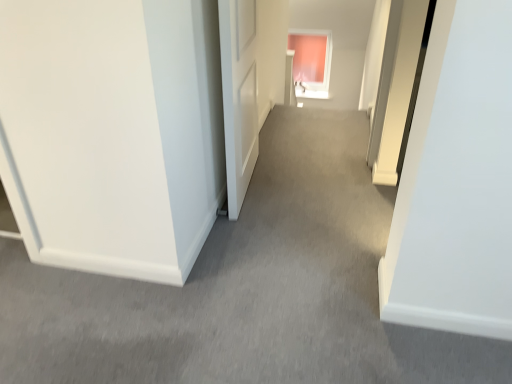
The height and width of the screenshot is (384, 512). In order to click on transparent glass window at upper center in this screenshot , I will do `click(311, 62)`.

What do you see at coordinates (311, 62) in the screenshot? The width and height of the screenshot is (512, 384). I see `transparent glass window at upper center` at bounding box center [311, 62].

The image size is (512, 384). Identify the location of transparent glass window at upper center. (311, 62).